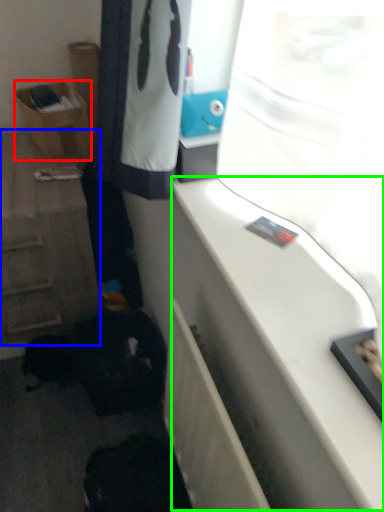
Question: Which object is the farthest from shelf (highlighted by a red box)? Choose among these: cabinetry (highlighted by a blue box) or counter top (highlighted by a green box).

Choices:
 (A) cabinetry
 (B) counter top

Answer: (B)